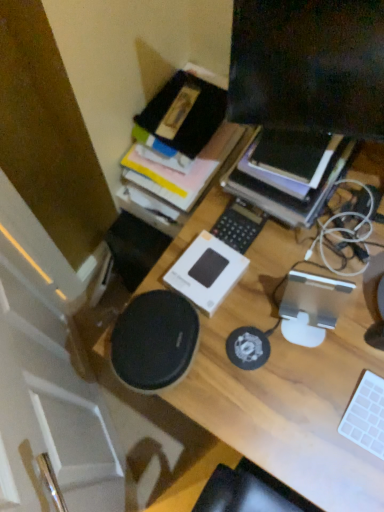
Question: Is point coord(249,242) positioned closer to the camera than point coord(178,244)?

Choices:
 (A) closer
 (B) farther

Answer: (B)

Question: Is white plastic keyboard at center, marked as the second laptop keyboard in a bottom-to-top arrangement, to the left or to the right of wooden desk at center in the image?

Choices:
 (A) left
 (B) right

Answer: (A)

Question: Estimate the real-world distances between objects in this image. Which object is farther from the wooden desk at center?

Choices:
 (A) white plastic keyboard at center, which is counted as the 2th laptop keyboard, starting from the front
 (B) white matte keyboard at lower right, acting as the second laptop keyboard starting from the back
 (C) matte black monitor at upper right
 (D) black matte book at upper right
 (E) black matte speaker at center

Answer: (C)

Question: Estimate the real-world distances between objects in this image. Which object is closer to the matte black monitor at upper right?

Choices:
 (A) wooden desk at center
 (B) black matte speaker at center
 (C) white matte keyboard at lower right, the first laptop keyboard from the right
 (D) black matte book at upper right
 (E) white plastic keyboard at center, which is counted as the 2th laptop keyboard, starting from the front

Answer: (D)